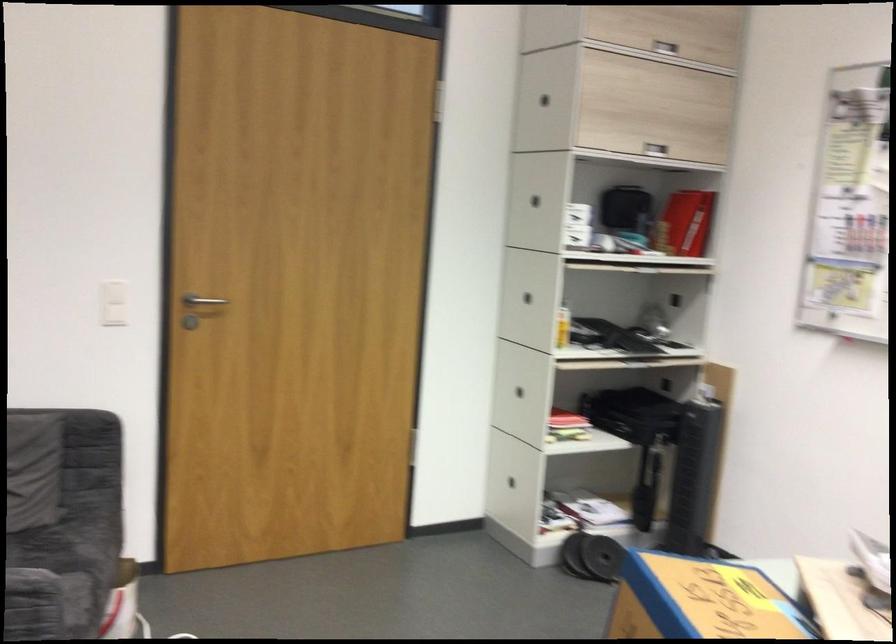
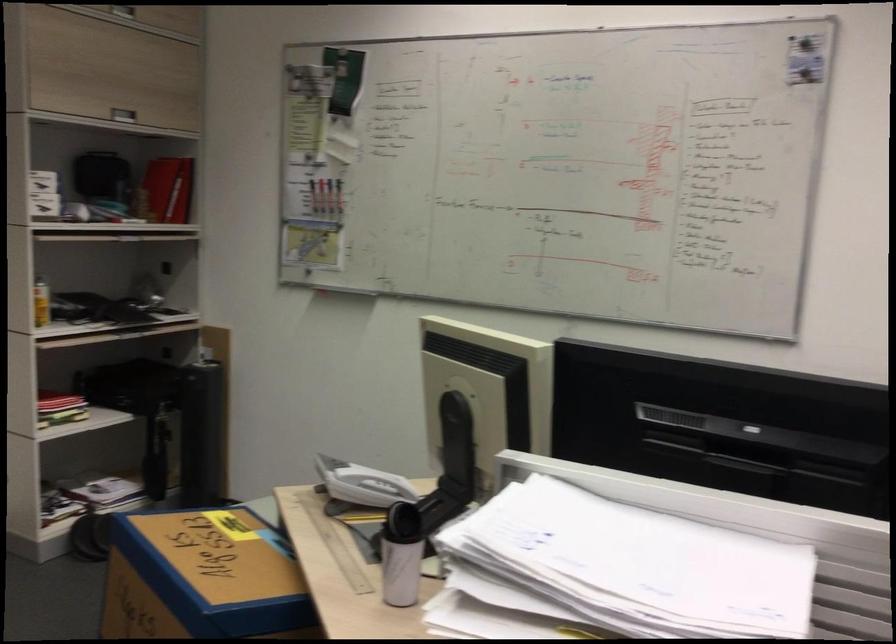
Locate, in the second image, the point that corresponds to the point at 691,219 in the first image.

(166, 190)